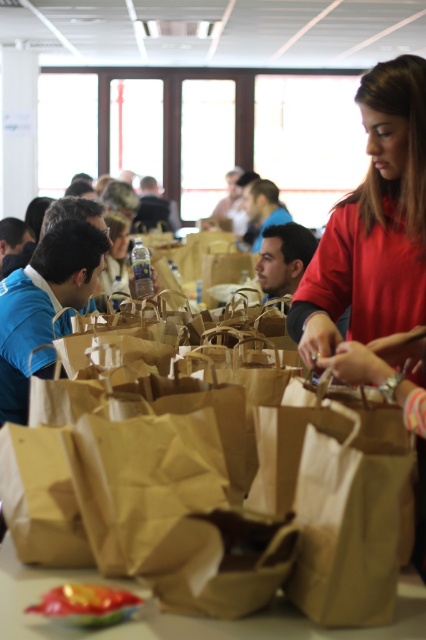
Question: Which is nearer to the shiny plastic bowl at center?

Choices:
 (A) matte blue shirt at center
 (B) brown paper bag at center
 (C) brown paper bag at lower center

Answer: (C)

Question: Is brown paper bag at lower center thinner than shiny plastic bowl at center?

Choices:
 (A) no
 (B) yes

Answer: (A)

Question: Can you confirm if brown paper bag at lower center is positioned to the left of matte blue shirt at center?

Choices:
 (A) no
 (B) yes

Answer: (B)

Question: Does brown paper bag at center lie in front of shiny plastic bowl at center?

Choices:
 (A) yes
 (B) no

Answer: (B)

Question: Which of the following is the closest to the observer?

Choices:
 (A) tap(0, 401)
 (B) tap(382, 636)

Answer: (B)

Question: Which point appears closest to the camera in this image?

Choices:
 (A) (63, 257)
 (B) (126, 598)
 (C) (195, 458)
 (D) (278, 208)

Answer: (B)